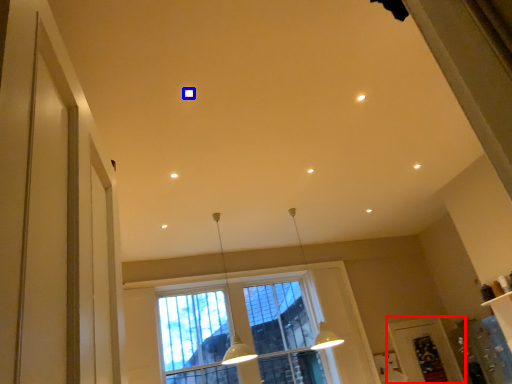
Question: Which object is closer to the camera taking this photo, screen door (highlighted by a red box) or lighting (highlighted by a blue box)?

Choices:
 (A) screen door
 (B) lighting

Answer: (B)